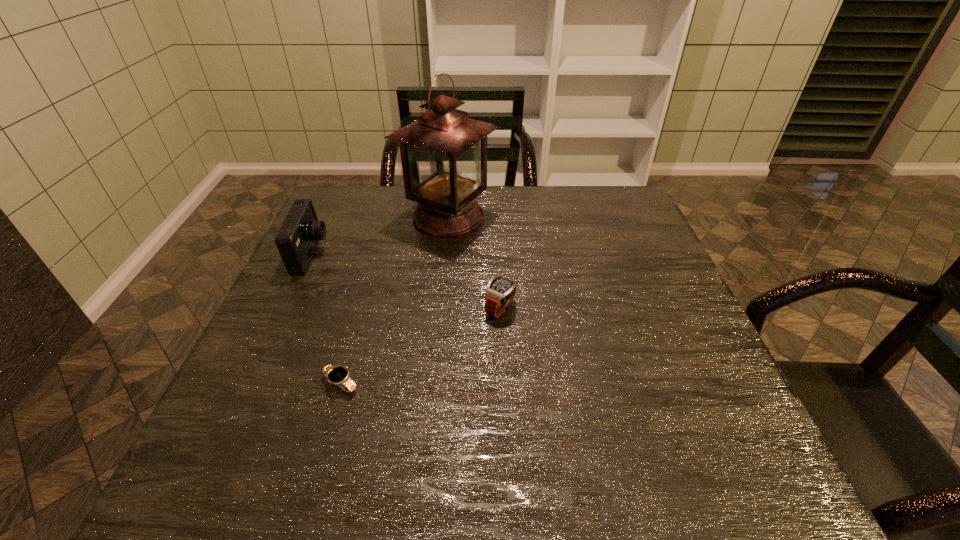
You are a GUI agent. You are given a task and a screenshot of the screen. Output one action in this format:
    pyautogui.click(x=<x>, y=<y>)
    Task: Click on the tallest object
    
    Given the screenshot: What is the action you would take?
    pyautogui.click(x=443, y=153)

What are the coordinates of `camera` in the screenshot? It's located at (297, 239).

The width and height of the screenshot is (960, 540). Identify the location of the leftmost object. (297, 239).

Find the location of a particular element. Image resolution: width=960 pixels, height=540 pixels. the right watch is located at coordinates (500, 292).

This screenshot has width=960, height=540. What are the coordinates of `the taller watch` in the screenshot? It's located at (500, 292).

The width and height of the screenshot is (960, 540). What are the coordinates of `the left watch` in the screenshot? It's located at (339, 375).

The height and width of the screenshot is (540, 960). Find the location of `the shorter watch`. the shorter watch is located at coordinates (339, 375).

At what (x,y) coordinates should I click in order to perform the action: click on free location located on the right of the oil lamp. Please return your answer as a coordinate pair (x, y). The height and width of the screenshot is (540, 960). Looking at the image, I should click on (546, 217).

Where is `vacant space positioned 0.340m on the front-facing side of the leftmost object`? vacant space positioned 0.340m on the front-facing side of the leftmost object is located at coordinates (456, 255).

Where is `blank space located on the back of the third tallest object`? blank space located on the back of the third tallest object is located at coordinates (498, 273).